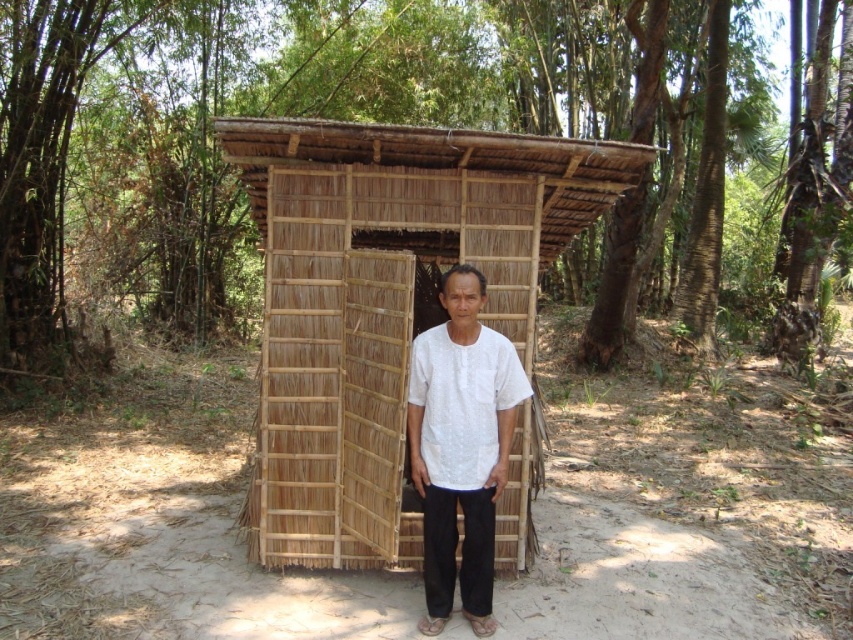
Question: Considering the relative positions of natural brown bamboo forest at center and bamboo mat hut at center in the image provided, where is natural brown bamboo forest at center located with respect to bamboo mat hut at center?

Choices:
 (A) left
 (B) right

Answer: (B)

Question: Which of the following is the farthest from the observer?

Choices:
 (A) natural brown bamboo forest at center
 (B) white cotton shirt at center
 (C) bamboo mat hut at center

Answer: (A)

Question: Which is farther from the white cotton shirt at center?

Choices:
 (A) natural brown bamboo forest at center
 (B) bamboo mat hut at center

Answer: (A)

Question: Does bamboo mat hut at center appear on the left side of white cotton shirt at center?

Choices:
 (A) yes
 (B) no

Answer: (A)

Question: Considering the relative positions of bamboo mat hut at center and white cotton shirt at center in the image provided, where is bamboo mat hut at center located with respect to white cotton shirt at center?

Choices:
 (A) above
 (B) below

Answer: (A)

Question: Considering the real-world distances, which object is farthest from the bamboo mat hut at center?

Choices:
 (A) natural brown bamboo forest at center
 (B) white cotton shirt at center

Answer: (A)